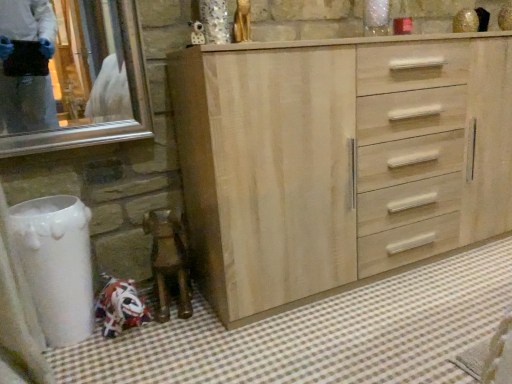
Question: From the image's perspective, is white checkered bath mat at lower left on top of light wood cabinet at center?

Choices:
 (A) yes
 (B) no

Answer: (B)

Question: Does white checkered bath mat at lower left appear on the left side of light wood cabinet at center?

Choices:
 (A) yes
 (B) no

Answer: (A)

Question: Is white checkered bath mat at lower left positioned far away from light wood cabinet at center?

Choices:
 (A) no
 (B) yes

Answer: (A)

Question: Is white checkered bath mat at lower left turned away from light wood cabinet at center?

Choices:
 (A) no
 (B) yes

Answer: (A)

Question: Is white checkered bath mat at lower left outside of light wood cabinet at center?

Choices:
 (A) no
 (B) yes

Answer: (B)

Question: Does white checkered bath mat at lower left touch light wood cabinet at center?

Choices:
 (A) yes
 (B) no

Answer: (B)

Question: From the image's perspective, is light wood cabinet at center under white checkered bath mat at lower left?

Choices:
 (A) yes
 (B) no

Answer: (B)

Question: Can you confirm if light wood cabinet at center is thinner than white checkered bath mat at lower left?

Choices:
 (A) yes
 (B) no

Answer: (A)

Question: From a real-world perspective, does light wood cabinet at center sit lower than white checkered bath mat at lower left?

Choices:
 (A) no
 (B) yes

Answer: (A)

Question: Considering the relative sizes of light wood cabinet at center and white checkered bath mat at lower left in the image provided, is light wood cabinet at center smaller than white checkered bath mat at lower left?

Choices:
 (A) no
 (B) yes

Answer: (A)

Question: Is light wood cabinet at center wider than white checkered bath mat at lower left?

Choices:
 (A) no
 (B) yes

Answer: (A)

Question: Is the surface of light wood cabinet at center in direct contact with white checkered bath mat at lower left?

Choices:
 (A) no
 (B) yes

Answer: (A)

Question: From the image's perspective, is light wood cabinet at center above or below white checkered bath mat at lower left?

Choices:
 (A) below
 (B) above

Answer: (B)